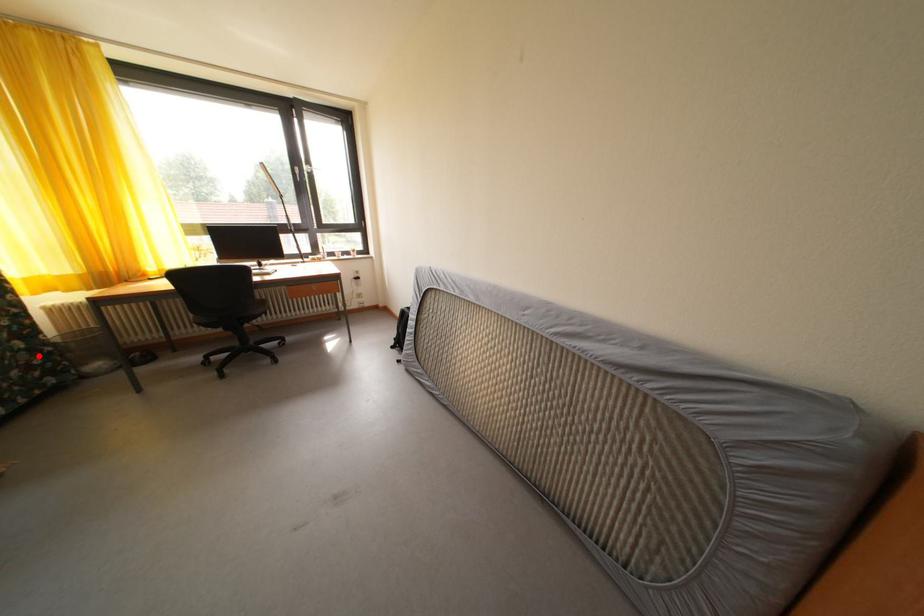
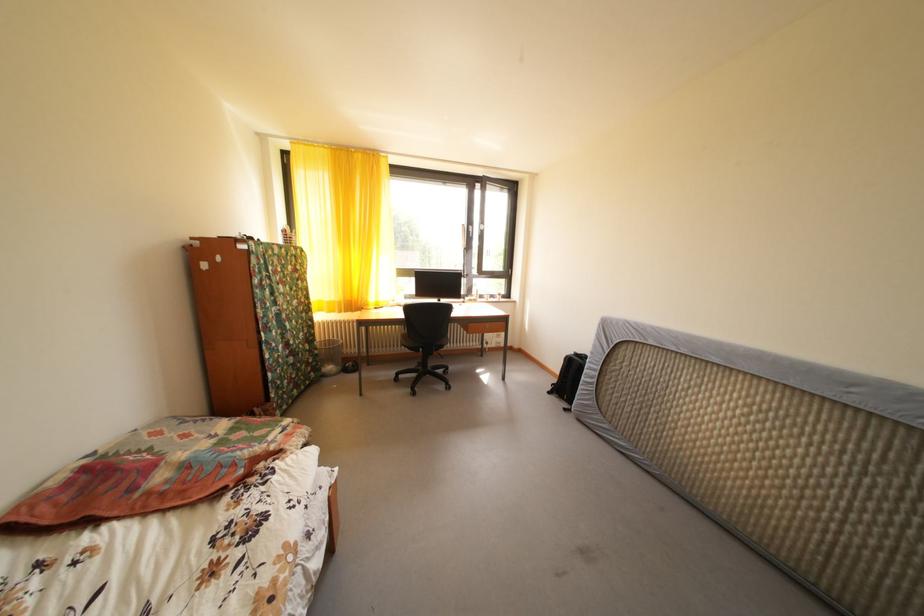
Find the pixel in the second image that matches the highlighted location in the first image.

(320, 357)